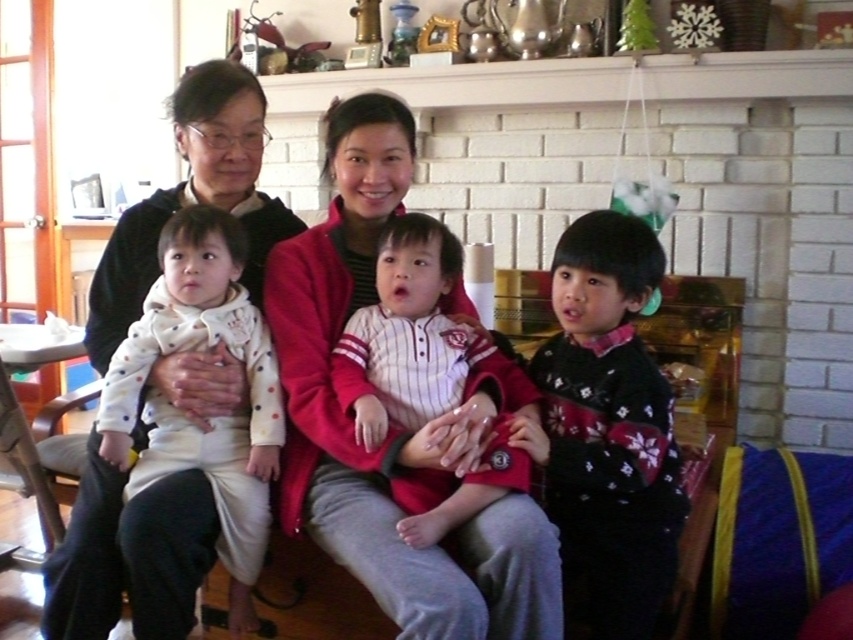
Which is more to the right, white dotted fabric baby at left or white striped fabric baby at center?

From the viewer's perspective, white striped fabric baby at center appears more on the right side.

Consider the image. Does white dotted fabric baby at left appear on the left side of white striped fabric baby at center?

Yes, white dotted fabric baby at left is to the left of white striped fabric baby at center.

Image resolution: width=853 pixels, height=640 pixels. What do you see at coordinates (213, 417) in the screenshot?
I see `white dotted fabric baby at left` at bounding box center [213, 417].

The image size is (853, 640). Identify the location of white dotted fabric baby at left. (213, 417).

Between matte white sweater at center and white striped fabric baby at center, which one has more height?

Standing taller between the two is matte white sweater at center.

Is point (387, 506) positioned before point (364, 356)?

That is True.

I want to click on matte white sweater at center, so (392, 428).

Which is behind, point (660, 260) or point (567, 541)?

Positioned behind is point (660, 260).

Measure the distance between point (x=465, y=556) and camera.

A distance of 1.34 meters exists between point (x=465, y=556) and camera.

Image resolution: width=853 pixels, height=640 pixels. What do you see at coordinates (392, 428) in the screenshot?
I see `matte white sweater at center` at bounding box center [392, 428].

Where is `matte white sweater at center`? This screenshot has height=640, width=853. matte white sweater at center is located at coordinates (392, 428).